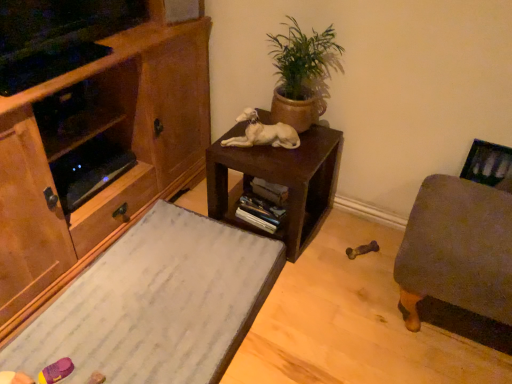
Describe the element at coordinates (156, 304) in the screenshot. This screenshot has height=384, width=512. I see `white marble desk at lower left` at that location.

Describe the element at coordinates (91, 131) in the screenshot. This screenshot has height=384, width=512. I see `wooden cabinet at left` at that location.

What is the approximate height of wooden cabinet at left?

The height of wooden cabinet at left is 29.64 inches.

The width and height of the screenshot is (512, 384). In order to click on brown matte table at center in this screenshot , I will do `click(280, 182)`.

You are a GUI agent. You are given a task and a screenshot of the screen. Output one action in this format:
    pyautogui.click(x=<x>, y=<y>)
    Task: Click on the white marble desk at lower left
    This screenshot has width=512, height=384.
    Given the screenshot: What is the action you would take?
    (x=156, y=304)

Is point (232, 169) positioned after point (318, 88)?

No, (232, 169) is closer to viewer.

Would you say brown matte table at center is a long distance from green matte pot at upper center?

No.

Is brown matte table at center shorter than green matte pot at upper center?

Yes, brown matte table at center is shorter than green matte pot at upper center.

From the image's perspective, is brown matte table at center on top of green matte pot at upper center?

No.

Is green matte pot at upper center taller or shorter than wooden cabinet at left?

green matte pot at upper center is shorter than wooden cabinet at left.

Is wooden cabinet at left surrounded by green matte pot at upper center?

No, wooden cabinet at left is located outside of green matte pot at upper center.

From a real-world perspective, between green matte pot at upper center and wooden cabinet at left, who is vertically lower?

In real-world perspective, wooden cabinet at left is lower.

Is green matte pot at upper center bigger than wooden cabinet at left?

Incorrect, green matte pot at upper center is not larger than wooden cabinet at left.

Which of these two, white marble desk at lower left or green matte pot at upper center, stands taller?

green matte pot at upper center is taller.

How distant is white marble desk at lower left from green matte pot at upper center?

They are 28.63 inches apart.

Which is behind, point (165, 231) or point (332, 57)?

Positioned behind is point (165, 231).

Is white marble desk at lower left in front of or behind green matte pot at upper center in the image?

Visually, white marble desk at lower left is located in front of green matte pot at upper center.

From a real-world perspective, between white marble desk at lower left and white glossy statue at center, who is vertically lower?

From a 3D spatial view, white marble desk at lower left is below.

From the image's perspective, does white marble desk at lower left appear higher than white glossy statue at center?

Incorrect, from the image's perspective, white marble desk at lower left is lower than white glossy statue at center.

Who is shorter, white marble desk at lower left or white glossy statue at center?

Standing shorter between the two is white glossy statue at center.

What are the coordinates of `desk that appears below the white glossy statue at center (from a real-world perspective)` in the screenshot? It's located at (156, 304).

How different are the orientations of brown matte table at center and white glossy statue at center in degrees?

61.2 degrees.

Is brown matte table at center shorter than white glossy statue at center?

No.

At what (x,y) coordinates should I click in order to perform the action: click on animal above the brown matte table at center (from the image's perspective). Please return your answer as a coordinate pair (x, y). The image size is (512, 384). Looking at the image, I should click on (263, 133).

Between white marble desk at lower left and wooden cabinet at left, which one has smaller size?

white marble desk at lower left.

From the image's perspective, which one is positioned higher, white marble desk at lower left or wooden cabinet at left?

wooden cabinet at left appears higher in the image.

Where is `desk below the wooden cabinet at left (from a real-world perspective)`? The width and height of the screenshot is (512, 384). desk below the wooden cabinet at left (from a real-world perspective) is located at coordinates (156, 304).

From a real-world perspective, does white marble desk at lower left stand above wooden cabinet at left?

No, from a real-world perspective, white marble desk at lower left is not on top of wooden cabinet at left.

Is wooden cabinet at left inside the boundaries of white marble desk at lower left, or outside?

wooden cabinet at left is not enclosed by white marble desk at lower left.

Which object is wider, wooden cabinet at left or white marble desk at lower left?

With larger width is wooden cabinet at left.

From the image's perspective, is wooden cabinet at left above white marble desk at lower left?

Yes, from the image's perspective, wooden cabinet at left is on top of white marble desk at lower left.

From a real-world perspective, relative to white marble desk at lower left, is wooden cabinet at left vertically above or below?

wooden cabinet at left is above white marble desk at lower left.

Where is `houseplant that appears above the brown matte table at center (from the image's perspective)`? The height and width of the screenshot is (384, 512). houseplant that appears above the brown matte table at center (from the image's perspective) is located at coordinates (302, 74).

This screenshot has width=512, height=384. Identify the location of houseplant above the wooden cabinet at left (from a real-world perspective). [302, 74].

Considering their positions, is brown matte table at center positioned further to white glossy statue at center than green matte pot at upper center?

The object further to white glossy statue at center is green matte pot at upper center.

When comparing their distances from white glossy statue at center, does wooden cabinet at left or white marble desk at lower left seem closer?

The object closer to white glossy statue at center is wooden cabinet at left.

Considering their positions, is white marble desk at lower left positioned further to brown matte table at center than white glossy statue at center?

white marble desk at lower left.

From the image, which object appears to be nearer to wooden cabinet at left, white glossy statue at center or green matte pot at upper center?

white glossy statue at center lies closer to wooden cabinet at left than the other object.

Based on the photo, considering their positions, is green matte pot at upper center positioned further to brown matte table at center than white glossy statue at center?

Among the two, green matte pot at upper center is located further to brown matte table at center.

When comparing their distances from white glossy statue at center, does wooden cabinet at left or brown matte table at center seem closer?

brown matte table at center lies closer to white glossy statue at center than the other object.

Estimate the real-world distances between objects in this image. Which object is further from white glossy statue at center, white marble desk at lower left or brown matte table at center?

Based on the image, white marble desk at lower left appears to be further to white glossy statue at center.

Which object lies further to the anchor point white glossy statue at center, white marble desk at lower left or wooden cabinet at left?

white marble desk at lower left is further to white glossy statue at center.

Where is `table between white glossy statue at center and white marble desk at lower left in the vertical direction`? table between white glossy statue at center and white marble desk at lower left in the vertical direction is located at coordinates (280, 182).

Where is `animal between green matte pot at upper center and brown matte table at center vertically`? The height and width of the screenshot is (384, 512). animal between green matte pot at upper center and brown matte table at center vertically is located at coordinates (263, 133).

Locate an element on the screen. desk between wooden cabinet at left and white glossy statue at center in the horizontal direction is located at coordinates (156, 304).

Identify the location of table located between wooden cabinet at left and green matte pot at upper center in the left-right direction. (280, 182).